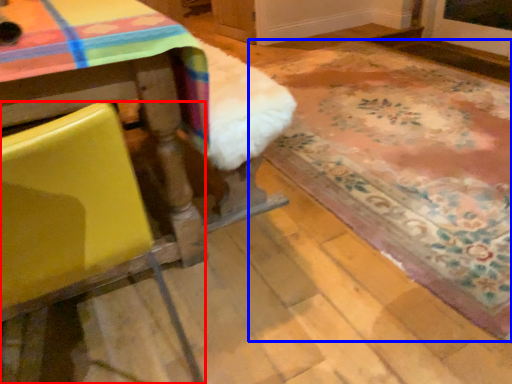
Question: Which object appears farthest to the camera in this image, chair (highlighted by a red box) or mat (highlighted by a blue box)?

Choices:
 (A) chair
 (B) mat

Answer: (B)